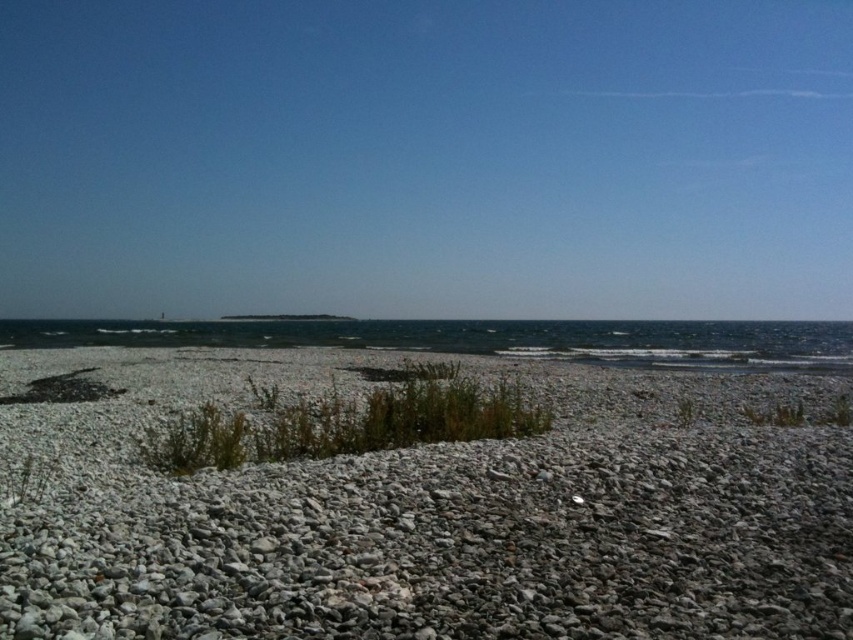
You are standing on the beach and want to walk from the gray gravel at center to the clear blue water at center. Which direction should you walk to reach the water first?

Since the gray gravel at center has a lesser width compared to the clear blue water at center, you should walk forward towards the water to reach the clear blue water at center first.

From the picture: You are standing on the pebble beach in the coastal scene. There are two points marked in the image. Which point, point (491, 582) or point (338, 339), is closer to you?

Point (491, 582) is closer to the viewer than point (338, 339).

Consider the image. You are standing on the pebble beach in the coastal scene. You notice a point marked at coordinates (432, 513). What is located at this point?

The point marked at coordinates (432, 513) is located at the gray gravel at center.